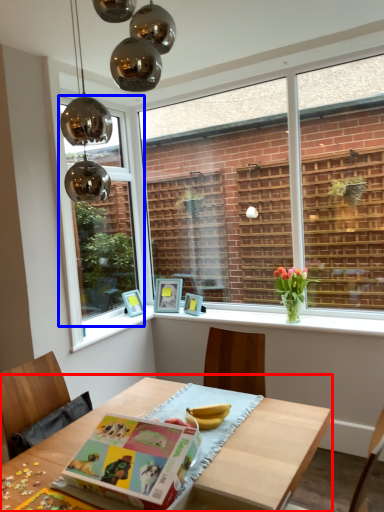
Question: Which object appears farthest to the camera in this image, table (highlighted by a red box) or window (highlighted by a blue box)?

Choices:
 (A) table
 (B) window

Answer: (B)